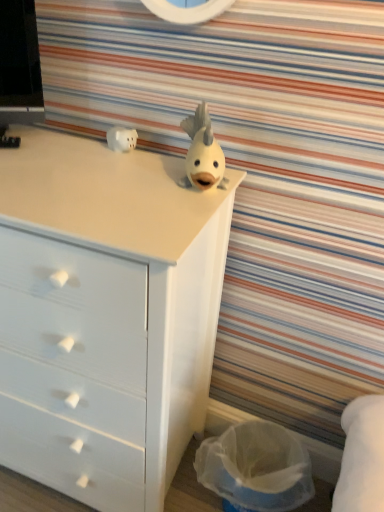
Identify the location of free space in front of white matte piggy bank at upper left, the 1th toy in the left-to-right sequence. (119, 169).